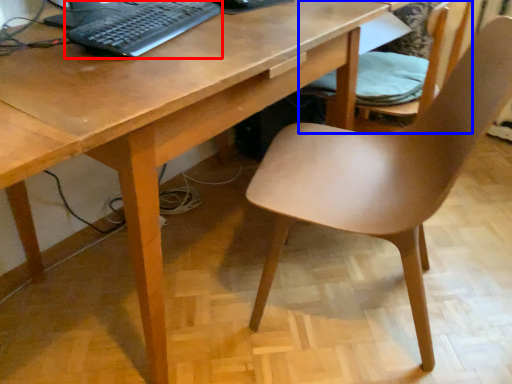
Question: Which object appears closest to the camera in this image, computer keyboard (highlighted by a red box) or chair (highlighted by a blue box)?

Choices:
 (A) computer keyboard
 (B) chair

Answer: (A)